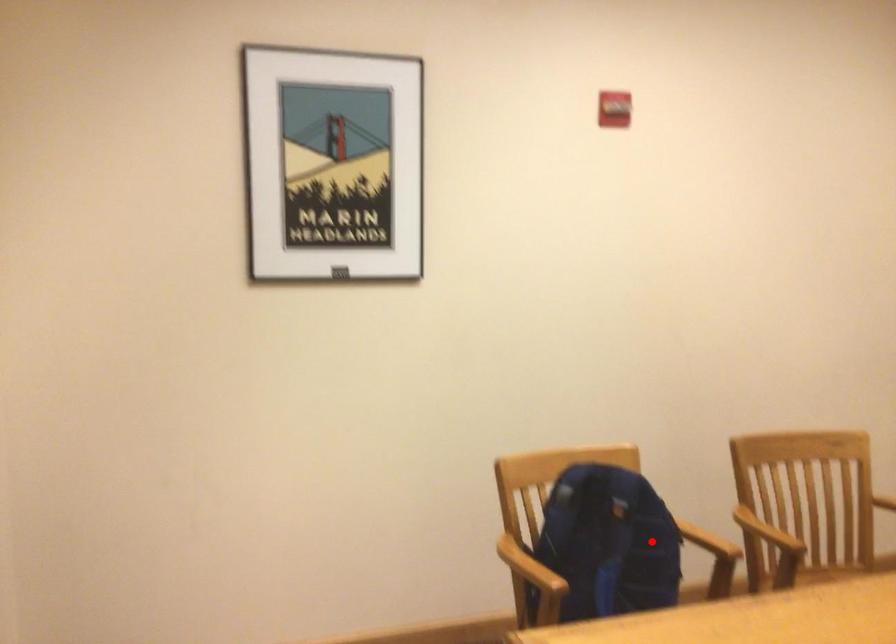
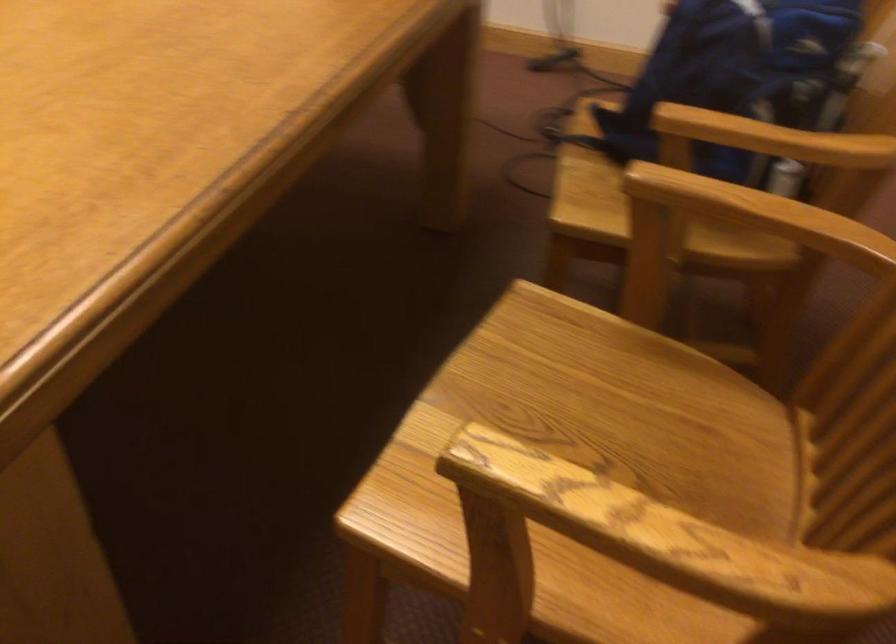
The point at the highlighted location is marked in the first image. Where is the corresponding point in the second image?

(736, 73)